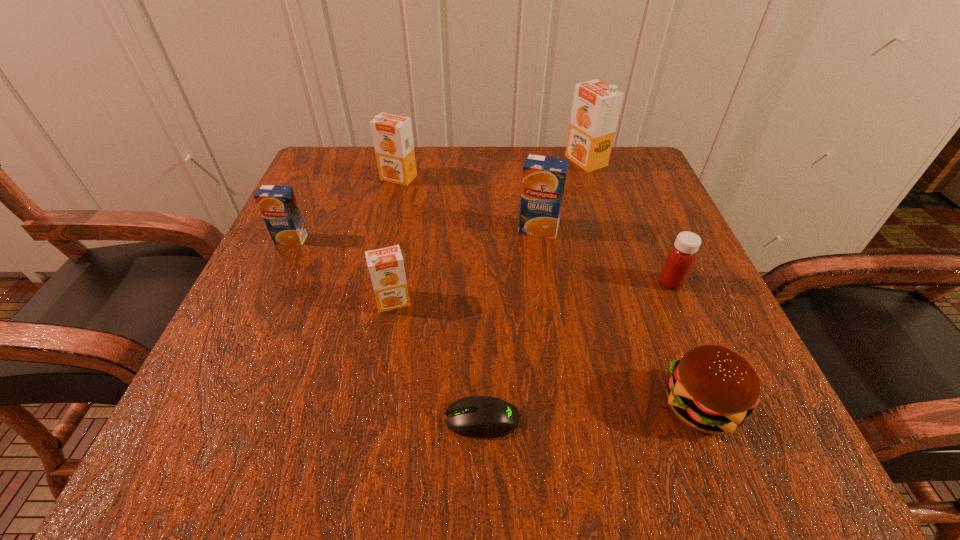
The image size is (960, 540). What are the coordinates of `vacant region located 0.120m on the wheel side of the gray computer mouse` in the screenshot? It's located at (352, 420).

Find the location of a particular element. This screenshot has height=540, width=960. free region located on the wheel side of the gray computer mouse is located at coordinates (306, 420).

What are the coordinates of `free space located 0.060m on the wheel side of the gray computer mouse` in the screenshot? It's located at (398, 420).

Where is `hamburger that is at the near edge`? This screenshot has width=960, height=540. hamburger that is at the near edge is located at coordinates (712, 389).

Locate an element on the screen. computer mouse at the near edge is located at coordinates (476, 416).

Image resolution: width=960 pixels, height=540 pixels. I want to click on orange juice at the right edge, so click(596, 106).

The width and height of the screenshot is (960, 540). What are the coordinates of `medicine located in the right edge section of the desktop` in the screenshot? It's located at (681, 258).

Locate an element on the screen. hamburger at the right edge is located at coordinates point(712,389).

The width and height of the screenshot is (960, 540). What are the coordinates of `object that is at the far left corner` in the screenshot? It's located at (392, 135).

Find the location of a particular element. This screenshot has height=540, width=960. object that is positioned at the far right corner is located at coordinates (596, 106).